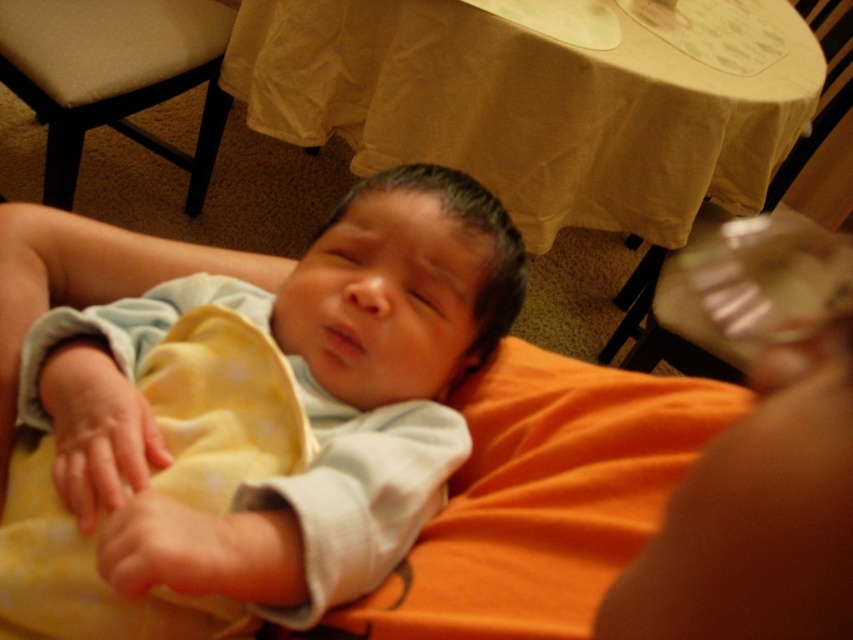
Question: Considering the real-world distances, which object is farthest from the beige fabric chair at upper left?

Choices:
 (A) smooth yellow cloth at lower left
 (B) soft yellow blanket at center
 (C) soft yellow cloth at lower left
 (D) transparent plastic cup at upper right

Answer: (D)

Question: Is beige fabric tablecloth at upper center positioned behind beige fabric chair at upper left?

Choices:
 (A) yes
 (B) no

Answer: (B)

Question: Which is farther from the smooth yellow cloth at lower left?

Choices:
 (A) beige fabric tablecloth at upper center
 (B) soft yellow cloth at lower left

Answer: (A)

Question: Does soft yellow cloth at lower left appear on the right side of transparent plastic cup at upper right?

Choices:
 (A) no
 (B) yes

Answer: (A)

Question: Is beige fabric tablecloth at upper center bigger than beige fabric chair at upper left?

Choices:
 (A) yes
 (B) no

Answer: (A)

Question: Which of the following is the closest to the observer?

Choices:
 (A) (201, 563)
 (B) (45, 116)
 (C) (210, 536)
 (D) (633, 218)

Answer: (A)